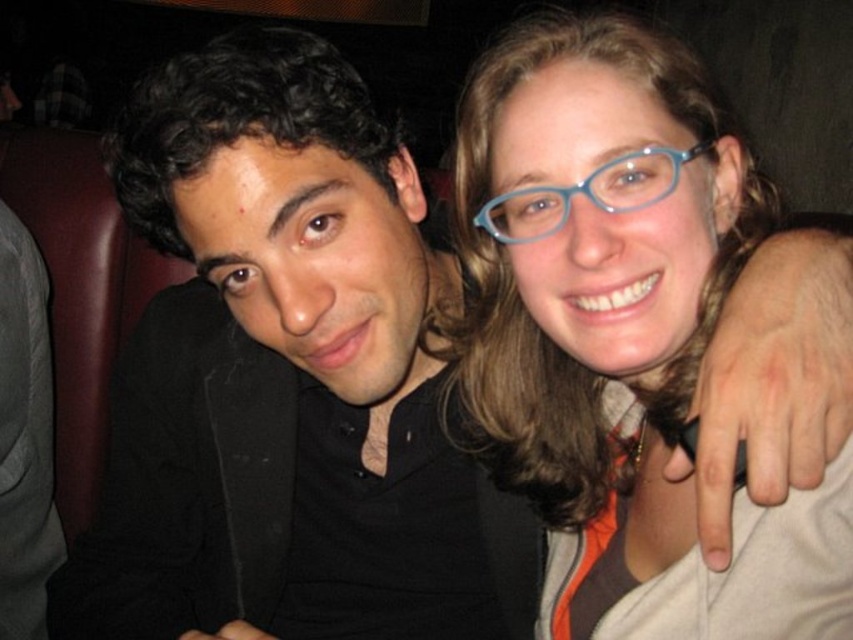
Question: Is the position of black matte jacket at left less distant than that of blue plastic glasses at upper center?

Choices:
 (A) yes
 (B) no

Answer: (B)

Question: Can you confirm if black matte jacket at left is wider than blue plastic glasses at upper right?

Choices:
 (A) no
 (B) yes

Answer: (B)

Question: Observing the image, what is the correct spatial positioning of black matte jacket at left in reference to blue plastic glasses at upper center?

Choices:
 (A) above
 (B) below

Answer: (B)

Question: Considering the real-world distances, which object is closest to the blue plastic glasses at upper center?

Choices:
 (A) black matte jacket at left
 (B) blue plastic glasses at upper right

Answer: (B)

Question: Which of the following is the closest to the observer?

Choices:
 (A) (640, 202)
 (B) (339, 602)

Answer: (A)

Question: Which point is farther from the camera taking this photo?

Choices:
 (A) [675, 316]
 (B) [653, 189]

Answer: (A)